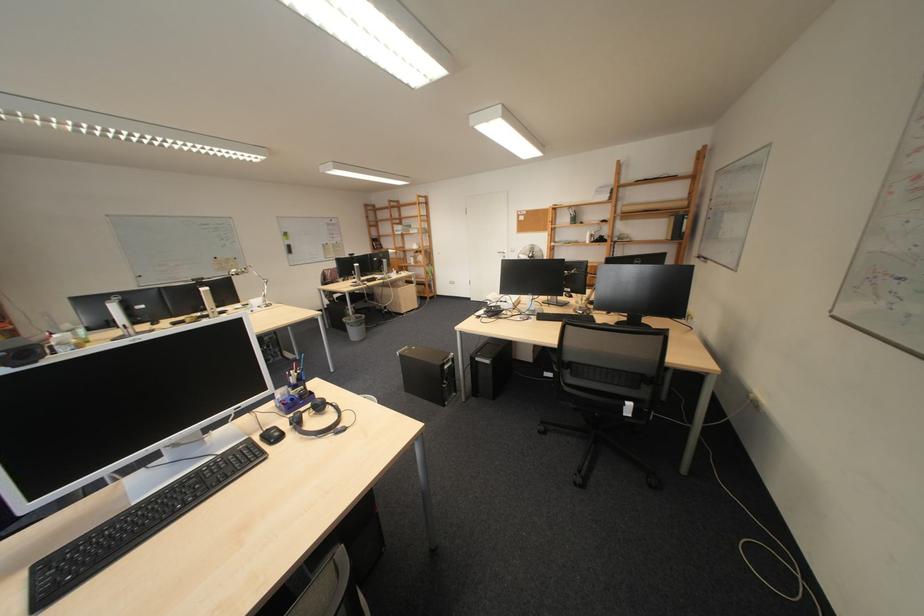
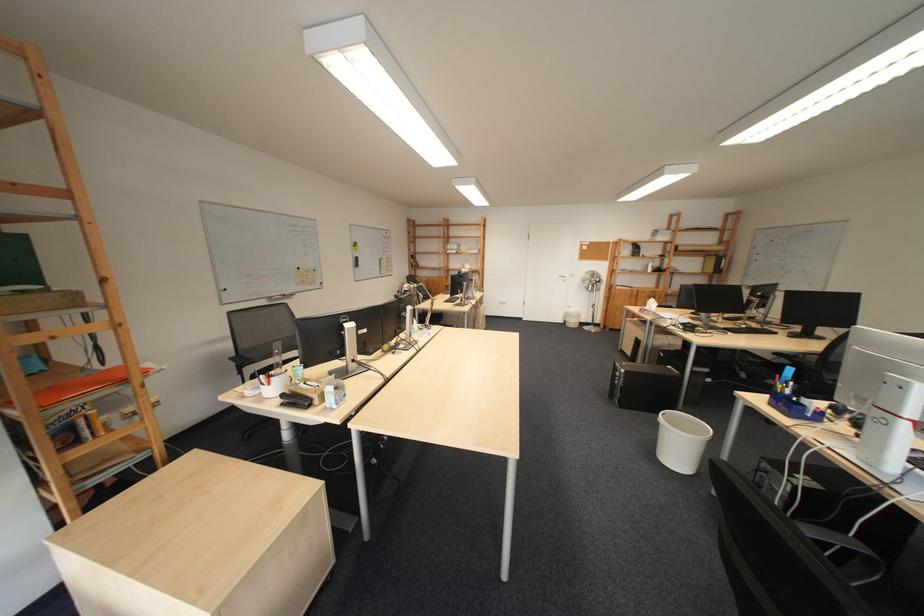
Question: The images are taken continuously from a first-person perspective. In which direction are you moving?

Choices:
 (A) Left
 (B) Right
 (C) Forward
 (D) Backward

Answer: (A)